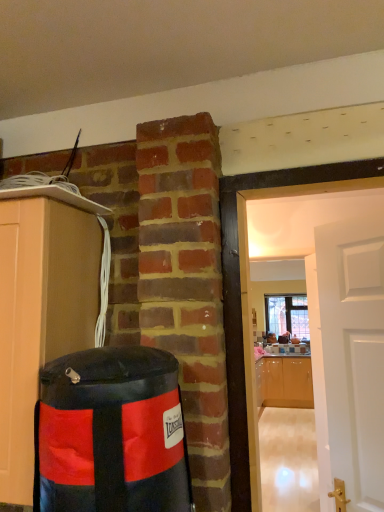
Question: Considering the relative sizes of clear glass window at center and glossy wood cabinets at right, placed as the 2th cabinetry when sorted from front to back, in the image provided, is clear glass window at center bigger than glossy wood cabinets at right, placed as the 2th cabinetry when sorted from front to back,?

Choices:
 (A) yes
 (B) no

Answer: (B)

Question: From a real-world perspective, is clear glass window at center on glossy wood cabinets at right, placed as the 2th cabinetry when sorted from front to back?

Choices:
 (A) no
 (B) yes

Answer: (B)

Question: Is glossy wood cabinets at right, placed as the 2th cabinetry when sorted from front to back, inside clear glass window at center?

Choices:
 (A) yes
 (B) no

Answer: (B)

Question: Is clear glass window at center with glossy wood cabinets at right, which ranks as the second cabinetry in left-to-right order?

Choices:
 (A) no
 (B) yes

Answer: (A)

Question: Can you confirm if clear glass window at center is shorter than glossy wood cabinets at right, which is counted as the first cabinetry, starting from the bottom?

Choices:
 (A) no
 (B) yes

Answer: (B)

Question: Considering their positions, is clear glass window at center located in front of or behind black vinyl punching bag at left?

Choices:
 (A) behind
 (B) front

Answer: (A)

Question: From the image's perspective, is clear glass window at center above or below black vinyl punching bag at left?

Choices:
 (A) above
 (B) below

Answer: (B)

Question: Is clear glass window at center wider or thinner than black vinyl punching bag at left?

Choices:
 (A) wide
 (B) thin

Answer: (B)

Question: From a real-world perspective, is clear glass window at center physically located above or below black vinyl punching bag at left?

Choices:
 (A) above
 (B) below

Answer: (A)

Question: Considering the positions of matte wood cabinet at left, which ranks as the second cabinetry in back-to-front order, and black vinyl punching bag at left in the image, is matte wood cabinet at left, which ranks as the second cabinetry in back-to-front order, bigger or smaller than black vinyl punching bag at left?

Choices:
 (A) big
 (B) small

Answer: (A)

Question: From their relative heights in the image, would you say matte wood cabinet at left, which ranks as the second cabinetry in back-to-front order, is taller or shorter than black vinyl punching bag at left?

Choices:
 (A) tall
 (B) short

Answer: (A)

Question: Is matte wood cabinet at left, which is counted as the 1th cabinetry, starting from the left, in front of or behind black vinyl punching bag at left in the image?

Choices:
 (A) behind
 (B) front

Answer: (A)

Question: From the image's perspective, is matte wood cabinet at left, the first cabinetry in the front-to-back sequence, above or below black vinyl punching bag at left?

Choices:
 (A) below
 (B) above

Answer: (B)

Question: In terms of height, does black vinyl punching bag at left look taller or shorter compared to clear glass window at center?

Choices:
 (A) tall
 (B) short

Answer: (B)

Question: Is black vinyl punching bag at left wider or thinner than clear glass window at center?

Choices:
 (A) thin
 (B) wide

Answer: (B)